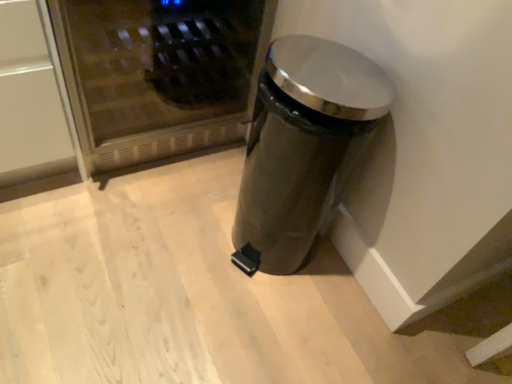
The image size is (512, 384). I want to click on stainless steel microwave at upper left, so (159, 75).

What do you see at coordinates (159, 75) in the screenshot? The height and width of the screenshot is (384, 512). I see `stainless steel microwave at upper left` at bounding box center [159, 75].

Where is `satin silver trash can at lower right`? satin silver trash can at lower right is located at coordinates (303, 147).

Image resolution: width=512 pixels, height=384 pixels. What do you see at coordinates (303, 147) in the screenshot? I see `satin silver trash can at lower right` at bounding box center [303, 147].

Locate an element on the screen. This screenshot has height=384, width=512. stainless steel microwave at upper left is located at coordinates (159, 75).

Between stainless steel microwave at upper left and satin silver trash can at lower right, which one appears on the right side from the viewer's perspective?

satin silver trash can at lower right.

Which is in front, stainless steel microwave at upper left or satin silver trash can at lower right?

satin silver trash can at lower right is in front.

Considering the points (87, 163) and (293, 222), which point is in front, point (87, 163) or point (293, 222)?

The point (293, 222) is closer to the camera.

From the image's perspective, would you say stainless steel microwave at upper left is positioned over satin silver trash can at lower right?

Yes, from the image's perspective, stainless steel microwave at upper left is above satin silver trash can at lower right.

From a real-world perspective, who is located lower, stainless steel microwave at upper left or satin silver trash can at lower right?

stainless steel microwave at upper left is physically lower.

Does stainless steel microwave at upper left have a greater width compared to satin silver trash can at lower right?

Yes.

Looking at this image, is stainless steel microwave at upper left shorter than satin silver trash can at lower right?

Yes.

In terms of size, does stainless steel microwave at upper left appear bigger or smaller than satin silver trash can at lower right?

Considering their sizes, stainless steel microwave at upper left takes up more space than satin silver trash can at lower right.

Which is correct: stainless steel microwave at upper left is inside satin silver trash can at lower right, or outside of it?

stainless steel microwave at upper left exists outside the volume of satin silver trash can at lower right.

Is stainless steel microwave at upper left next to satin silver trash can at lower right and touching it?

No, stainless steel microwave at upper left is not touching satin silver trash can at lower right.

Is stainless steel microwave at upper left positioned with its back to satin silver trash can at lower right?

stainless steel microwave at upper left does not have its back to satin silver trash can at lower right.

How much distance is there between stainless steel microwave at upper left and satin silver trash can at lower right?

They are 14.38 inches apart.

Find the location of a particular element. The width and height of the screenshot is (512, 384). waste container to the right of stainless steel microwave at upper left is located at coordinates (303, 147).

Considering the relative positions of satin silver trash can at lower right and stainless steel microwave at upper left in the image provided, is satin silver trash can at lower right to the left of stainless steel microwave at upper left from the viewer's perspective?

Incorrect, satin silver trash can at lower right is not on the left side of stainless steel microwave at upper left.

Is the position of satin silver trash can at lower right more distant than that of stainless steel microwave at upper left?

No, the depth of satin silver trash can at lower right is less than that of stainless steel microwave at upper left.

Considering the positions of point (281, 110) and point (206, 136), is point (281, 110) closer or farther from the camera than point (206, 136)?

Point (281, 110) appears to be closer to the viewer than point (206, 136).

From the image's perspective, does satin silver trash can at lower right appear higher than stainless steel microwave at upper left?

Incorrect, from the image's perspective, satin silver trash can at lower right is lower than stainless steel microwave at upper left.

From a real-world perspective, relative to stainless steel microwave at upper left, is satin silver trash can at lower right vertically above or below?

From a real-world perspective, satin silver trash can at lower right is physically above stainless steel microwave at upper left.

Considering the relative sizes of satin silver trash can at lower right and stainless steel microwave at upper left in the image provided, is satin silver trash can at lower right wider than stainless steel microwave at upper left?

In fact, satin silver trash can at lower right might be narrower than stainless steel microwave at upper left.

Considering the relative sizes of satin silver trash can at lower right and stainless steel microwave at upper left in the image provided, is satin silver trash can at lower right shorter than stainless steel microwave at upper left?

Incorrect, the height of satin silver trash can at lower right does not fall short of that of stainless steel microwave at upper left.

Is satin silver trash can at lower right bigger or smaller than stainless steel microwave at upper left?

Considering their sizes, satin silver trash can at lower right takes up less space than stainless steel microwave at upper left.

In the scene shown: Do you think satin silver trash can at lower right is within stainless steel microwave at upper left, or outside of it?

satin silver trash can at lower right cannot be found inside stainless steel microwave at upper left.

Is satin silver trash can at lower right far away from stainless steel microwave at upper left?

That's not correct — satin silver trash can at lower right is a little close to stainless steel microwave at upper left.

Looking at this image, is satin silver trash can at lower right oriented towards stainless steel microwave at upper left?

No.

Measure the distance from satin silver trash can at lower right to stainless steel microwave at upper left.

A distance of 14.38 inches exists between satin silver trash can at lower right and stainless steel microwave at upper left.

Locate an element on the screen. The image size is (512, 384). microwave below the satin silver trash can at lower right (from a real-world perspective) is located at coordinates (159, 75).

Where is `microwave that appears below the satin silver trash can at lower right (from a real-world perspective)`? This screenshot has height=384, width=512. microwave that appears below the satin silver trash can at lower right (from a real-world perspective) is located at coordinates point(159,75).

This screenshot has width=512, height=384. In order to click on waste container that is in front of the stainless steel microwave at upper left in this screenshot , I will do pos(303,147).